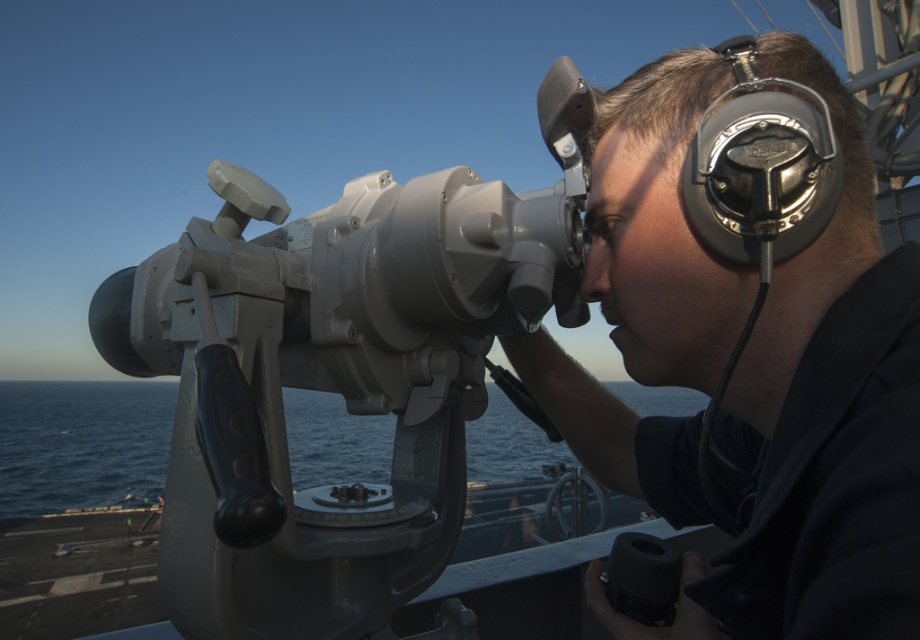
Who is more forward, (859, 256) or (769, 120)?

Point (769, 120) is more forward.

What do you see at coordinates (782, 429) in the screenshot? This screenshot has height=640, width=920. I see `metallic gray binoculars at center` at bounding box center [782, 429].

This screenshot has height=640, width=920. Identify the location of metallic gray binoculars at center. (782, 429).

Between metallic gray binoculars at center and blue water at lower left, which one appears on the right side from the viewer's perspective?

Positioned to the right is metallic gray binoculars at center.

What do you see at coordinates (782, 429) in the screenshot?
I see `metallic gray binoculars at center` at bounding box center [782, 429].

You are a GUI agent. You are given a task and a screenshot of the screen. Output one action in this format:
    pyautogui.click(x=<x>, y=<y>)
    Task: Click on the metallic gray binoculars at center
    Image resolution: width=920 pixels, height=640 pixels.
    Given the screenshot: What is the action you would take?
    pyautogui.click(x=782, y=429)

Which of these two, blue water at lower left or metallic/reflective headset at upper right, stands shorter?

metallic/reflective headset at upper right

Can you confirm if blue water at lower left is positioned to the right of metallic/reflective headset at upper right?

No, blue water at lower left is not to the right of metallic/reflective headset at upper right.

Where is `blue water at lower left`? This screenshot has width=920, height=640. blue water at lower left is located at coordinates (81, 444).